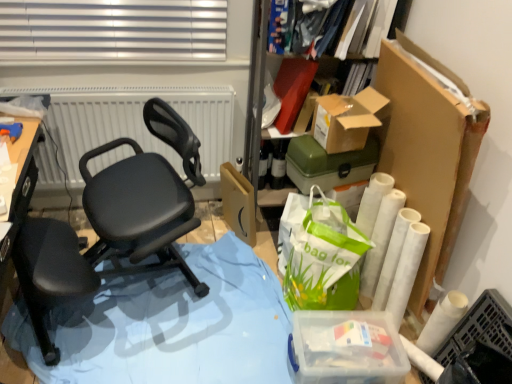
Question: Does green plastic storage box at upper right, the 2th storage box positioned from the bottom, come behind matte black office chair at center?

Choices:
 (A) no
 (B) yes

Answer: (B)

Question: Does green plastic storage box at upper right, the 2th storage box positioned from the bottom, have a lesser height compared to matte black office chair at center?

Choices:
 (A) yes
 (B) no

Answer: (A)

Question: Is green plastic storage box at upper right, the 2th storage box positioned from the bottom, positioned far away from matte black office chair at center?

Choices:
 (A) no
 (B) yes

Answer: (A)

Question: Considering the relative positions of green plastic storage box at upper right, the 2th storage box positioned from the bottom, and matte black office chair at center in the image provided, is green plastic storage box at upper right, the 2th storage box positioned from the bottom, to the left of matte black office chair at center from the viewer's perspective?

Choices:
 (A) yes
 (B) no

Answer: (B)

Question: From a real-world perspective, is green plastic storage box at upper right, the 2th storage box positioned from the bottom, physically above matte black office chair at center?

Choices:
 (A) yes
 (B) no

Answer: (A)

Question: Does green plastic storage box at upper right, the 2th storage box positioned from the bottom, contain matte black office chair at center?

Choices:
 (A) yes
 (B) no

Answer: (B)

Question: From a real-world perspective, is blue plastic table at lower left over matte white radiator at upper center?

Choices:
 (A) yes
 (B) no

Answer: (B)

Question: Is blue plastic table at lower left smaller than matte white radiator at upper center?

Choices:
 (A) no
 (B) yes

Answer: (A)

Question: Is blue plastic table at lower left shorter than matte white radiator at upper center?

Choices:
 (A) no
 (B) yes

Answer: (B)

Question: Does blue plastic table at lower left have a greater height compared to matte white radiator at upper center?

Choices:
 (A) yes
 (B) no

Answer: (B)

Question: From a real-world perspective, is blue plastic table at lower left located beneath matte white radiator at upper center?

Choices:
 (A) no
 (B) yes

Answer: (B)

Question: Is blue plastic table at lower left outside matte white radiator at upper center?

Choices:
 (A) no
 (B) yes

Answer: (B)

Question: Can you confirm if green plastic storage box at upper right, the 2th storage box positioned from the bottom, is shorter than clear plastic container at lower right, arranged as the first storage box when ordered from the bottom?

Choices:
 (A) no
 (B) yes

Answer: (A)